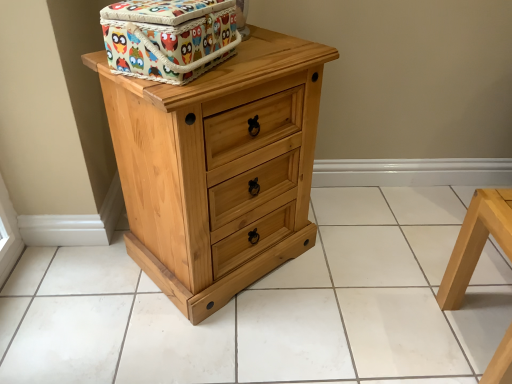
The width and height of the screenshot is (512, 384). I want to click on free area behind light wood stool at lower right, so tap(444, 271).